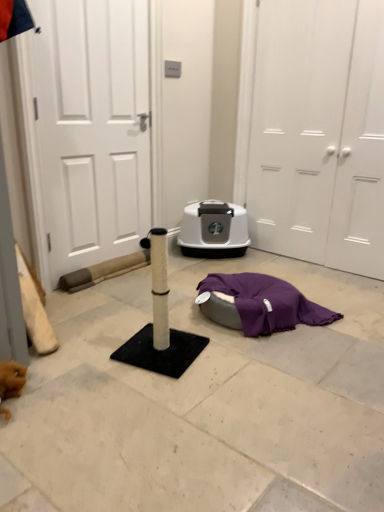
Question: From the image's perspective, is purple fabric at lower center above or below white matte door at left, acting as the first door starting from the left?

Choices:
 (A) above
 (B) below

Answer: (B)

Question: Is purple fabric at lower center wider or thinner than white matte door at left, the 3th door from the right?

Choices:
 (A) wide
 (B) thin

Answer: (A)

Question: Based on their relative distances, which object is nearer to the purple fabric at lower center?

Choices:
 (A) white matte door at right, the first door from the right
 (B) white matte door at center, which appears as the second door when viewed from the left
 (C) white textured scratching post at center
 (D) white matte door at left, acting as the first door starting from the left

Answer: (C)

Question: Considering the real-world distances, which object is closest to the white textured scratching post at center?

Choices:
 (A) purple fabric at lower center
 (B) white matte door at right, the first door from the right
 (C) white matte door at center, the 2th door from the right
 (D) white matte door at left, the 3th door from the right

Answer: (A)